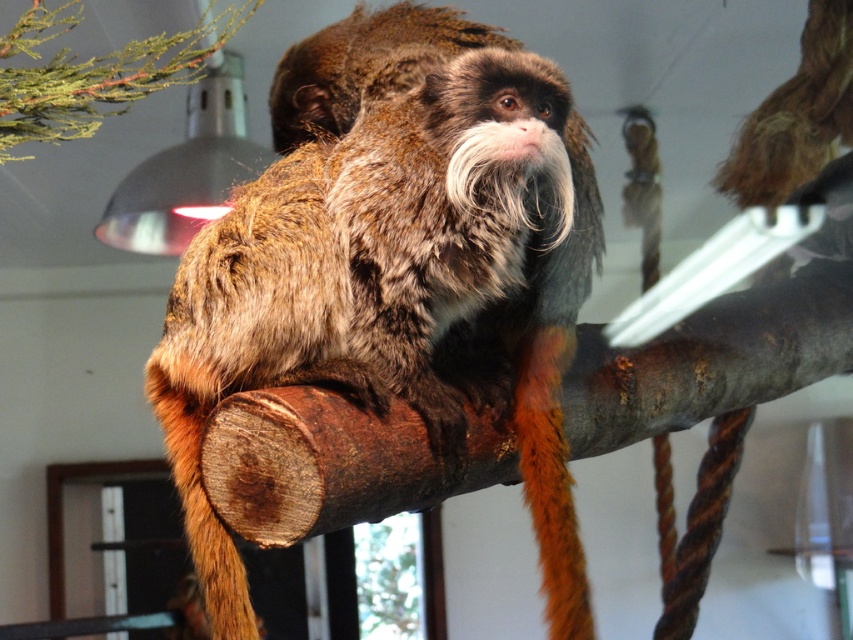
You are observing the tamarin monkey and notice two points marked on the image. The first point is at coordinates point (471, 116) and the second is at point (28, 156). Which of these points is nearer to you?

Point (471, 116) is closer to the viewer than point (28, 156).

You are a zookeeper observing the brown furry monkey at center and the green leafy branch at upper left. Which object takes up more space in the image?

The brown furry monkey at center is larger in size than the green leafy branch at upper left, so it takes up more space in the image.

You are a zookeeper trying to locate the brown furry monkey at center in the enclosure. Based on the 2D coordinates provided, where would you expect to find it in the image?

The brown furry monkey at center is located at the 2D coordinates point (375, 262) in the image.